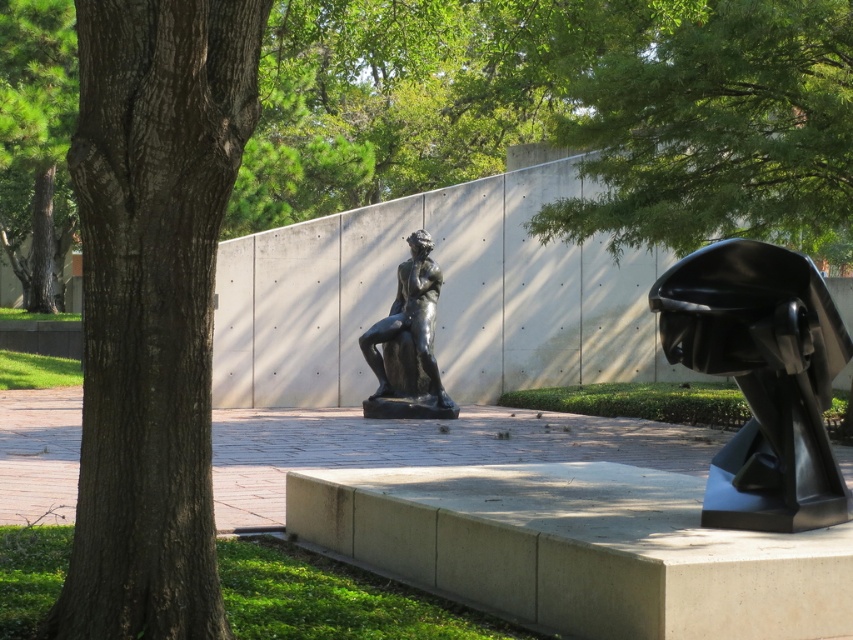
You are standing at the entrance of the sculpture garden and want to locate two specific points marked in the image. The first point is at coordinates point (106, 451) and the second is at point (729, 342). From your vantage point, which point appears closer to you?

Point (106, 451) is in front of point (729, 342), so it appears closer to you.

Based on the photo, you are standing in the sculpture garden and want to take a photo of the brown rough bark tree at left without any obstructions. Is the tree within your camera lens range if your camera can focus up to 6 meters?

The brown rough bark tree at left is 5.67 meters from viewer, which is within the camera lens range of 6 meters. Therefore, you can take a clear photo without obstructions.

You are standing in the sculpture garden and want to take a photo of the black glossy sculpture at right. If your camera has a maximum focus range of 25 feet, will you be able to capture it clearly?

The black glossy sculpture at right is 25.54 feet away from the viewer. Since the camera can only focus up to 25 feet, it won cannot capture it clearly within the current distance.